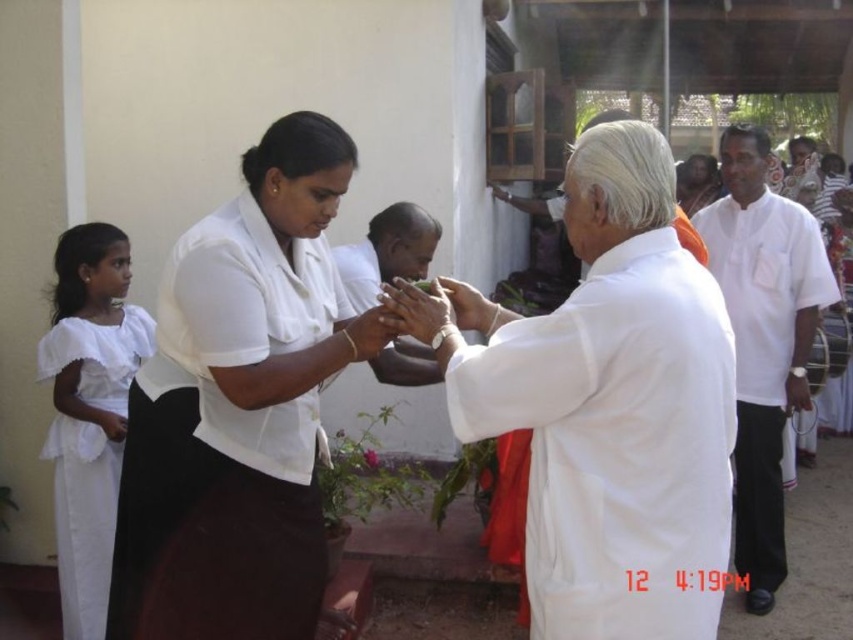
Does white matte dress at center have a lesser width compared to white satin robe at left?

No.

Which is behind, point (264, 317) or point (79, 330)?

Positioned behind is point (79, 330).

Identify the location of white matte dress at center. The height and width of the screenshot is (640, 853). (236, 408).

Which is more to the right, white cloth at center or white cotton robe at right?

white cotton robe at right

Between white cloth at center and white cotton robe at right, which one is positioned higher?

white cloth at center is above.

The height and width of the screenshot is (640, 853). What do you see at coordinates (616, 442) in the screenshot?
I see `white cloth at center` at bounding box center [616, 442].

This screenshot has width=853, height=640. In order to click on white cloth at center in this screenshot , I will do `click(616, 442)`.

Is white cloth at center taller than matte white hands at center?

Correct, white cloth at center is much taller as matte white hands at center.

The image size is (853, 640). Find the location of `white cloth at center`. white cloth at center is located at coordinates (616, 442).